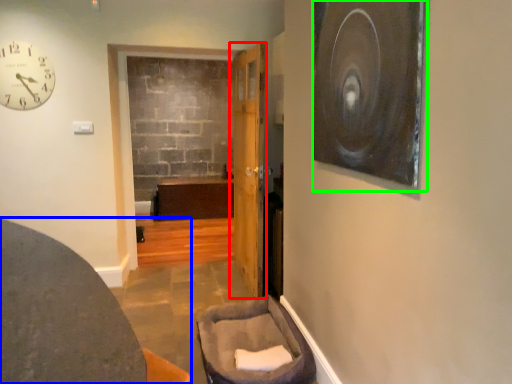
Question: Based on their relative distances, which object is nearer to door (highlighted by a red box)? Choose from furniture (highlighted by a blue box) and picture frame (highlighted by a green box).

Choices:
 (A) furniture
 (B) picture frame

Answer: (B)